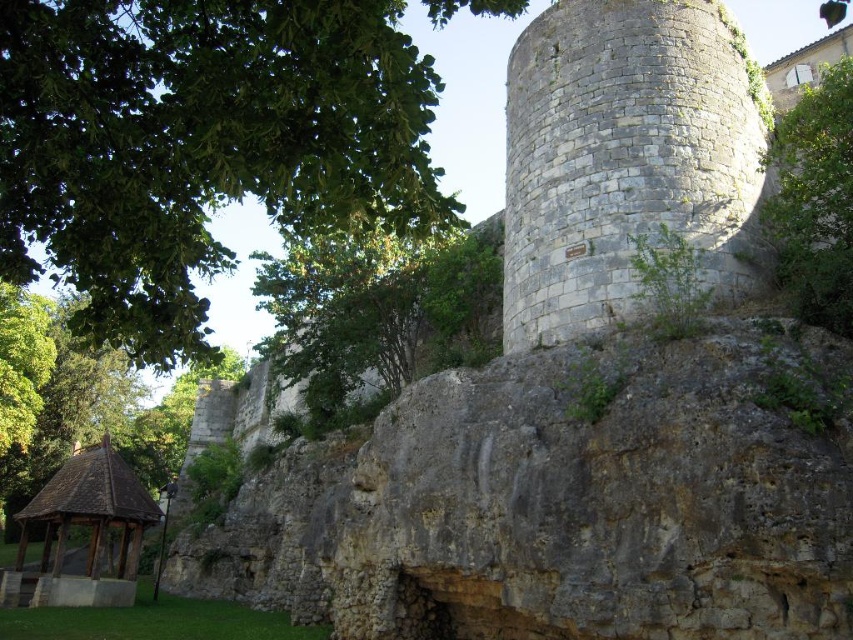
Where is `green leafy tree at upper left`? The height and width of the screenshot is (640, 853). green leafy tree at upper left is located at coordinates (199, 145).

Can you confirm if green leafy tree at upper left is positioned to the right of green leafy tree at upper right?

In fact, green leafy tree at upper left is to the left of green leafy tree at upper right.

Who is more forward, (299,109) or (798,192)?

Positioned in front is point (299,109).

The width and height of the screenshot is (853, 640). Find the location of `green leafy tree at upper left`. green leafy tree at upper left is located at coordinates (199, 145).

Is point (444, 248) more distant than point (805, 116)?

Yes.

Which is in front, point (489, 291) or point (840, 118)?

Point (840, 118)

What do you see at coordinates (379, 308) in the screenshot? I see `green leafy tree at upper center` at bounding box center [379, 308].

Find the location of `green leafy tree at upper center`. green leafy tree at upper center is located at coordinates (379, 308).

Is point (788, 188) in front of point (84, 602)?

Yes, point (788, 188) is closer to viewer.

Who is more distant from viewer, [763,161] or [61,566]?

The point [61,566] is behind.

Is point (796, 141) closer to viewer compared to point (68, 508)?

Yes.

Where is `green leafy tree at upper right`? The width and height of the screenshot is (853, 640). green leafy tree at upper right is located at coordinates (815, 200).